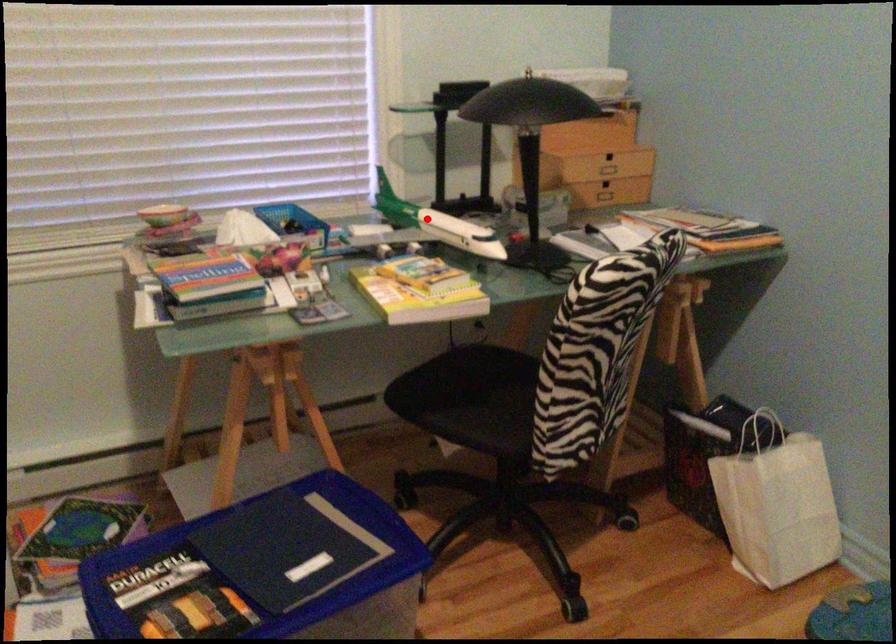
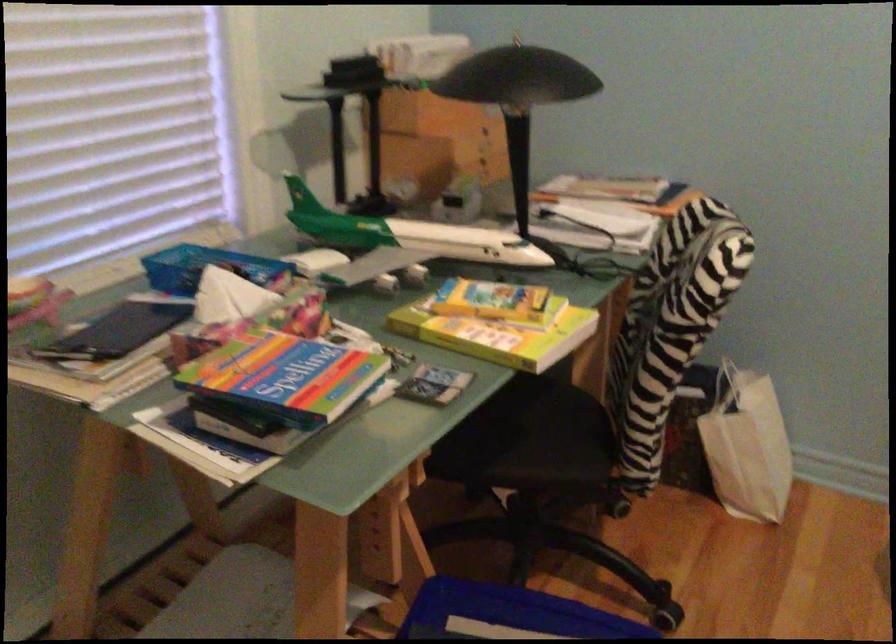
The point at the highlighted location is marked in the first image. Where is the corresponding point in the second image?

(408, 232)